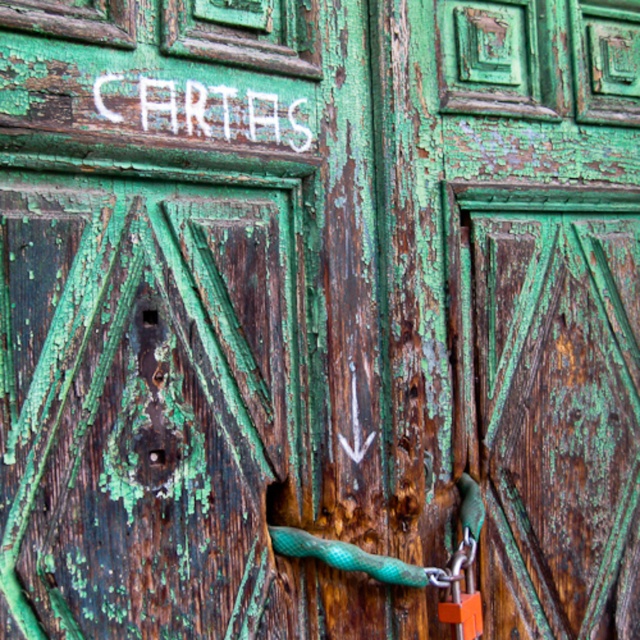
Question: Which point appears farthest from the camera in this image?

Choices:
 (A) (278, 129)
 (B) (448, 602)
 (C) (310, 282)

Answer: (B)

Question: Is white painted letters at upper center further to camera compared to orange metallic padlock at lower right?

Choices:
 (A) yes
 (B) no

Answer: (B)

Question: Which point is farther to the camera?

Choices:
 (A) white painted letters at upper center
 (B) green weathered wood door at center
 (C) orange metallic padlock at lower right

Answer: (C)

Question: Which of the following is the farthest from the observer?

Choices:
 (A) white painted letters at upper center
 (B) green weathered wood door at center

Answer: (A)

Question: Does green weathered wood door at center appear on the left side of white painted letters at upper center?

Choices:
 (A) no
 (B) yes

Answer: (A)

Question: Is green weathered wood door at center above white painted letters at upper center?

Choices:
 (A) yes
 (B) no

Answer: (B)